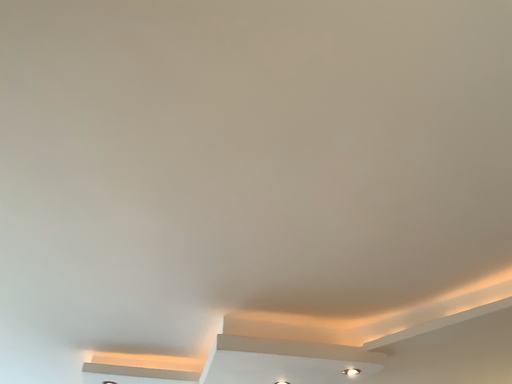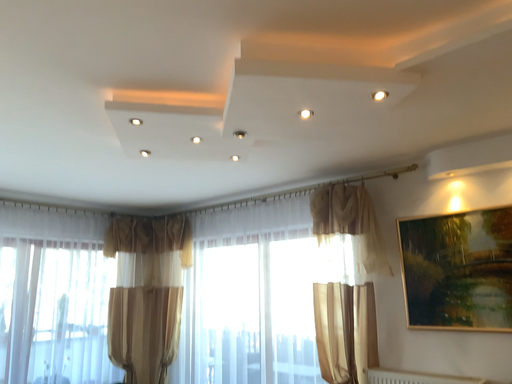
Question: How did the camera likely rotate when shooting the video?

Choices:
 (A) rotated upward
 (B) rotated downward

Answer: (B)